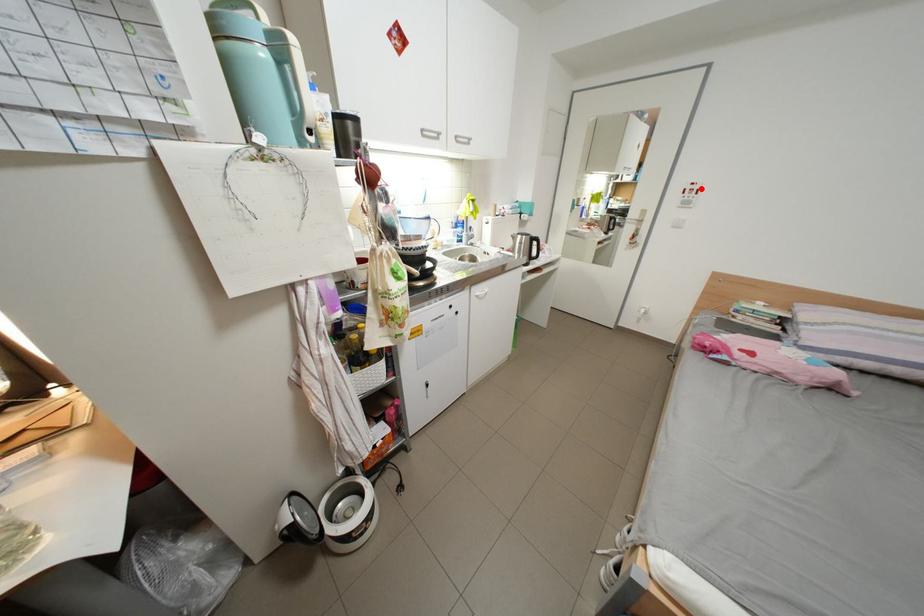
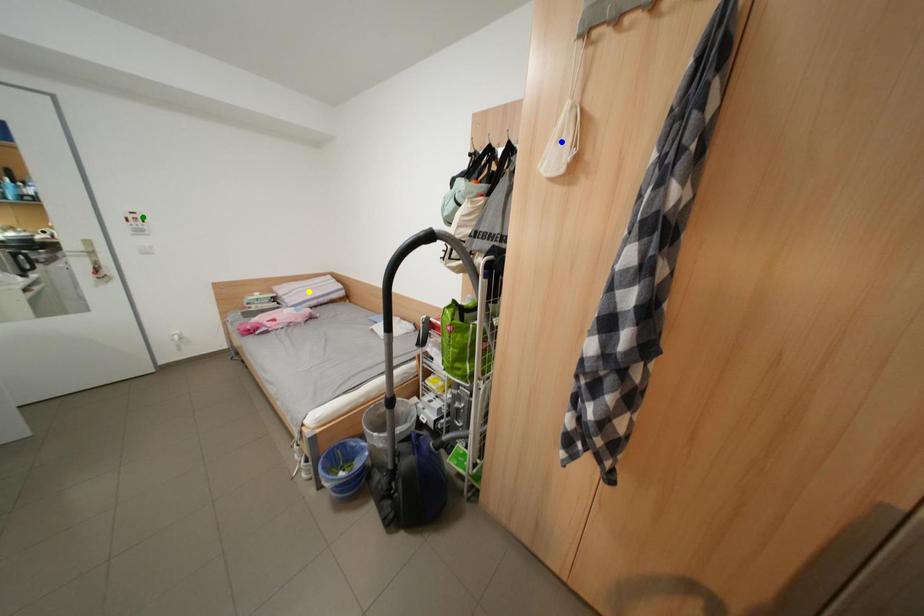
Question: I am providing you with two images of the same scene from different viewpoints. A red point is marked on the first image. You are given multiple points on the second image. In image 2, which mark is for the same physical point as the one in image 1?

Choices:
 (A) blue point
 (B) yellow point
 (C) green point

Answer: (C)